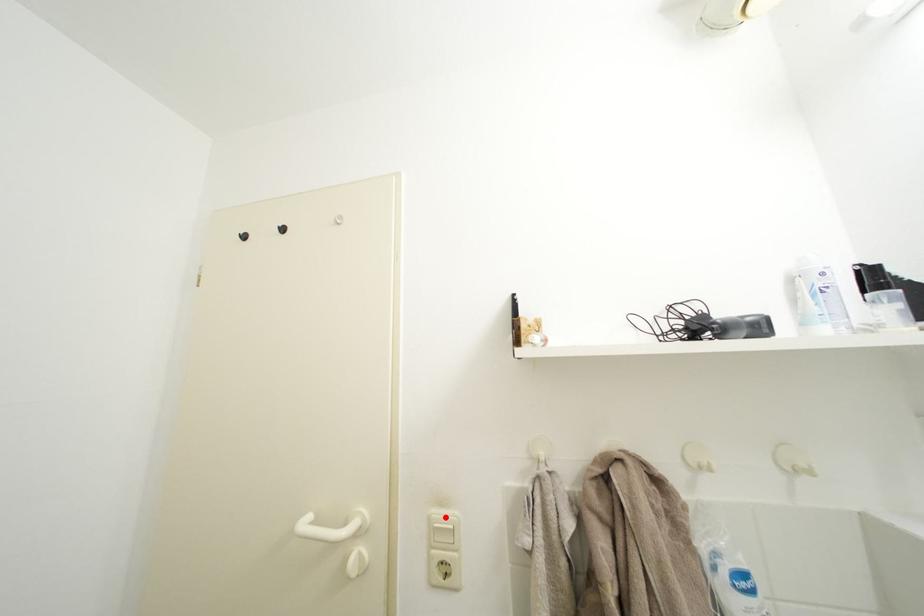
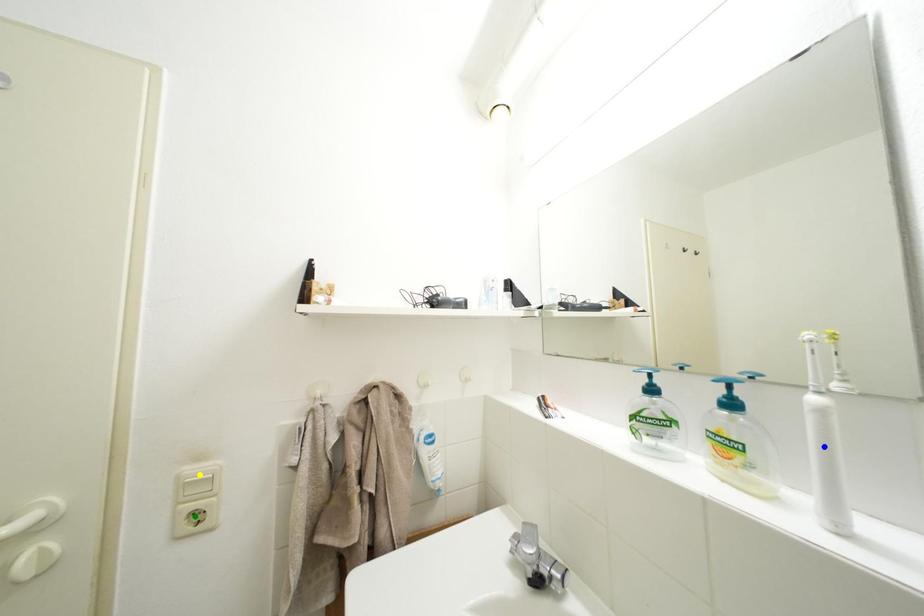
Question: I am providing you with two images of the same scene from different viewpoints. A red point is marked on the first image. You are given multiple points on the second image. Which mark in image 2 goes with the point in image 1?

Choices:
 (A) yellow point
 (B) blue point
 (C) green point

Answer: (A)